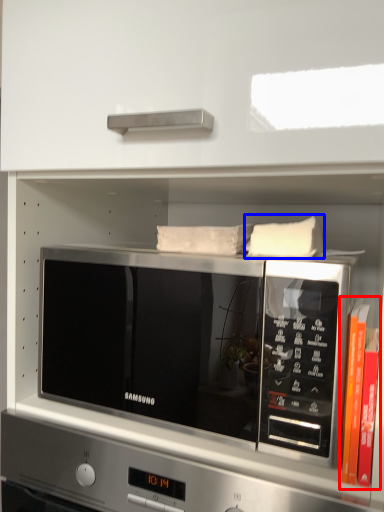
Question: Which object is closer to the camera taking this photo, book (highlighted by a red box) or pillow (highlighted by a blue box)?

Choices:
 (A) book
 (B) pillow

Answer: (A)